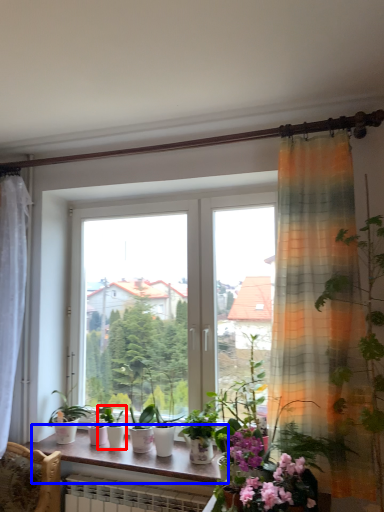
Question: Among these objects, which one is farthest to the camera, houseplant (highlighted by a red box) or window sill (highlighted by a blue box)?

Choices:
 (A) houseplant
 (B) window sill

Answer: (A)